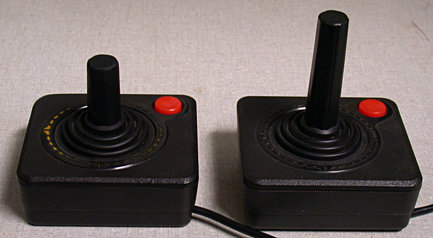
This screenshot has height=238, width=433. Find the location of `carpet floor`. carpet floor is located at coordinates (205, 73).